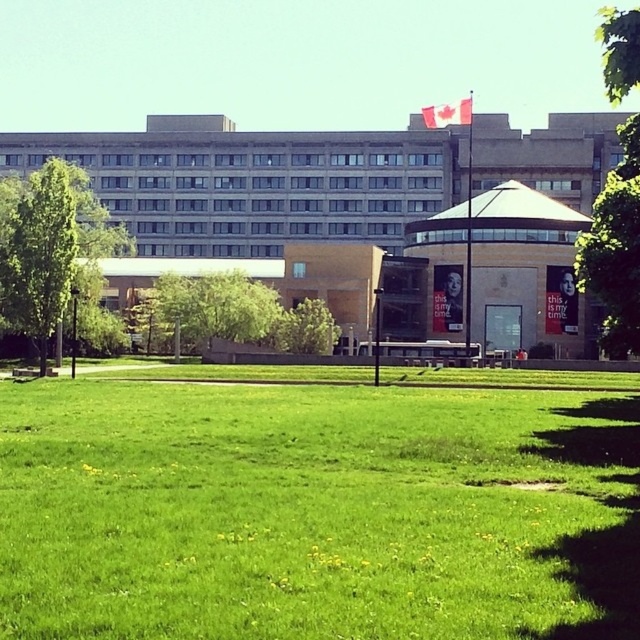
Which is above, green leafy tree at left or green leafy tree at upper right?

green leafy tree at upper right

Which is more to the right, green leafy tree at left or green leafy tree at upper right?

green leafy tree at upper right

Measure the distance between point (x=13, y=272) and camera.

A distance of 171.11 feet exists between point (x=13, y=272) and camera.

At what (x,y) coordinates should I click in order to perform the action: click on green leafy tree at left. Please return your answer as a coordinate pair (x, y). This screenshot has width=640, height=640. Looking at the image, I should click on (54, 259).

Does green grass at center appear over green leafy tree at upper right?

Incorrect, green grass at center is not positioned above green leafy tree at upper right.

Can you confirm if green grass at center is bigger than green leafy tree at upper right?

Incorrect, green grass at center is not larger than green leafy tree at upper right.

Which is behind, point (275, 573) or point (611, 237)?

Point (611, 237)

This screenshot has width=640, height=640. Find the location of `green grass at center`. green grass at center is located at coordinates (320, 506).

Is point (252, 560) positioned before point (49, 317)?

Yes.

Which is more to the left, green grass at center or green leafy tree at left?

Positioned to the left is green leafy tree at left.

Locate an element on the screen. The height and width of the screenshot is (640, 640). green grass at center is located at coordinates (320, 506).